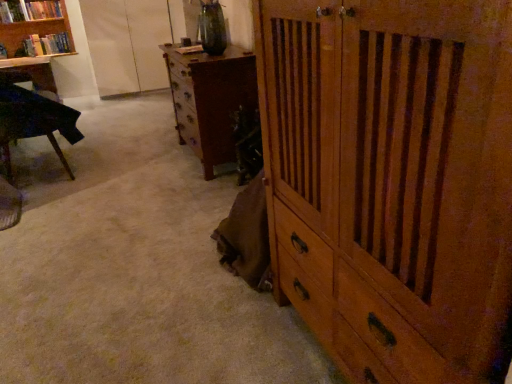
Image resolution: width=512 pixels, height=384 pixels. What do you see at coordinates (31, 74) in the screenshot?
I see `matte black desk at left` at bounding box center [31, 74].

Identify the location of white fabric screen door at upper left. [x=127, y=44].

Image resolution: width=512 pixels, height=384 pixels. I want to click on wooden bookshelf at upper left, so click(x=32, y=22).

What do you see at coordinates (47, 44) in the screenshot? The image size is (512, 384). I see `hardcover book at upper left, the 1th book when ordered from bottom to top` at bounding box center [47, 44].

Identify the location of matte black desk at left. (31, 74).

Is hardcover book at upper left, the 1th book when ordered from bottom to top, positioned beyond the bounds of wooden bookshelf at upper left?

No, most part of hardcover book at upper left, the 1th book when ordered from bottom to top, lies within wooden bookshelf at upper left.

From the wooden bookshelf at upper left, count 2nd book to the right and point to it. Please provide its 2D coordinates.

[(47, 44)]

Can you tell me how much hardcover book at upper left, the 1th book when ordered from bottom to top, and wooden bookshelf at upper left differ in facing direction?

0.00258 degrees separate the facing orientations of hardcover book at upper left, the 1th book when ordered from bottom to top, and wooden bookshelf at upper left.

Can you confirm if hardcover book at upper left, the 1th book when ordered from bottom to top, is positioned to the left of wooden bookshelf at upper left?

In fact, hardcover book at upper left, the 1th book when ordered from bottom to top, is to the right of wooden bookshelf at upper left.

Looking at their sizes, would you say black glossy table at left is wider or thinner than hardcover book at upper left, which is the second book from top to bottom?

Clearly, black glossy table at left has more width compared to hardcover book at upper left, which is the second book from top to bottom.

Is point (0, 104) behind point (42, 47)?

No, it is in front of (42, 47).

I want to click on chair on the right side of hardcover book at upper left, which is the second book from top to bottom, so click(x=38, y=118).

Is point (6, 19) closer to viewer compared to point (223, 66)?

No, it is not.

From the picture: In terms of width, does hardcover book at upper left, arranged as the second book when ordered from the bottom, look wider or thinner when compared to brown wooden chest of drawers at center, placed as the 1th chest of drawers when sorted from back to front?

Considering their sizes, hardcover book at upper left, arranged as the second book when ordered from the bottom, looks slimmer than brown wooden chest of drawers at center, placed as the 1th chest of drawers when sorted from back to front.

In the scene shown: Is hardcover book at upper left, arranged as the second book when ordered from the bottom, not within brown wooden chest of drawers at center, placed as the 2th chest of drawers when sorted from right to left?

That's correct, hardcover book at upper left, arranged as the second book when ordered from the bottom, is outside of brown wooden chest of drawers at center, placed as the 2th chest of drawers when sorted from right to left.

Does hardcover book at upper left, arranged as the second book when ordered from the bottom, turn towards brown wooden chest of drawers at center, placed as the 2th chest of drawers when sorted from right to left?

No, hardcover book at upper left, arranged as the second book when ordered from the bottom, does not turn towards brown wooden chest of drawers at center, placed as the 2th chest of drawers when sorted from right to left.

Consider the image. Between wooden bookshelf at upper left and white fabric screen door at upper left, which one has smaller width?

With smaller width is wooden bookshelf at upper left.

Does wooden bookshelf at upper left touch white fabric screen door at upper left?

No.

The image size is (512, 384). What are the coordinates of `bookcase above the white fabric screen door at upper left (from the image's perspective)` in the screenshot? It's located at (32, 22).

Is white fabric screen door at upper left at the right side of hardcover book at upper left, which is the 1th book in top-to-bottom order?

Yes.

Could you tell me if white fabric screen door at upper left is turned towards hardcover book at upper left, arranged as the second book when ordered from the bottom?

No, white fabric screen door at upper left is not oriented towards hardcover book at upper left, arranged as the second book when ordered from the bottom.

From the picture: From a real-world perspective, is white fabric screen door at upper left below hardcover book at upper left, which is the 1th book in top-to-bottom order?

Indeed, from a real-world perspective, white fabric screen door at upper left is positioned beneath hardcover book at upper left, which is the 1th book in top-to-bottom order.

Between white fabric screen door at upper left and hardcover book at upper left, which is the 1th book in top-to-bottom order, which one has smaller size?

With smaller size is hardcover book at upper left, which is the 1th book in top-to-bottom order.

Is wooden bookshelf at upper left further to camera compared to matte black desk at left?

Yes.

Are wooden bookshelf at upper left and matte black desk at left located far from each other?

wooden bookshelf at upper left is actually quite close to matte black desk at left.

Is wooden bookshelf at upper left situated inside matte black desk at left or outside?

wooden bookshelf at upper left is not enclosed by matte black desk at left.

Where is `bookcase on the left of matte black desk at left`? bookcase on the left of matte black desk at left is located at coordinates (32, 22).

Can you confirm if wooden cabinet at center, positioned as the first chest of drawers in right-to-left order, is positioned to the right of hardcover book at upper left, which is the second book from top to bottom?

Indeed, wooden cabinet at center, positioned as the first chest of drawers in right-to-left order, is positioned on the right side of hardcover book at upper left, which is the second book from top to bottom.

Considering the sizes of objects wooden cabinet at center, which is the first chest of drawers in front-to-back order, and hardcover book at upper left, which is the second book from top to bottom, in the image provided, who is taller, wooden cabinet at center, which is the first chest of drawers in front-to-back order, or hardcover book at upper left, which is the second book from top to bottom,?

Standing taller between the two is wooden cabinet at center, which is the first chest of drawers in front-to-back order.

From a real-world perspective, is wooden cabinet at center, marked as the second chest of drawers in a left-to-right arrangement, over hardcover book at upper left, which is the second book from top to bottom?

Incorrect, from a real-world perspective, wooden cabinet at center, marked as the second chest of drawers in a left-to-right arrangement, is lower than hardcover book at upper left, which is the second book from top to bottom.

Which is correct: wooden cabinet at center, marked as the second chest of drawers in a left-to-right arrangement, is inside hardcover book at upper left, the 1th book when ordered from bottom to top, or outside of it?

wooden cabinet at center, marked as the second chest of drawers in a left-to-right arrangement, is not enclosed by hardcover book at upper left, the 1th book when ordered from bottom to top.

Identify the location of the 2nd book behind when counting from the wooden bookshelf at upper left. (47, 44).

Identify the location of book that is the 1st one when counting leftward from the black glossy table at left. The image size is (512, 384). (47, 44).

Estimate the real-world distances between objects in this image. Which object is further from brown wooden chest of drawers at center, placed as the 1th chest of drawers when sorted from back to front, hardcover book at upper left, which is the second book from top to bottom, or white fabric screen door at upper left?

Among the two, hardcover book at upper left, which is the second book from top to bottom, is located further to brown wooden chest of drawers at center, placed as the 1th chest of drawers when sorted from back to front.

Based on their spatial positions, is white fabric screen door at upper left or wooden bookshelf at upper left closer to hardcover book at upper left, which is the 1th book in top-to-bottom order?

wooden bookshelf at upper left is closer to hardcover book at upper left, which is the 1th book in top-to-bottom order.

Consider the image. Based on their spatial positions, is black glossy table at left or hardcover book at upper left, which is the second book from top to bottom, closer to matte black desk at left?

Among the two, hardcover book at upper left, which is the second book from top to bottom, is located nearer to matte black desk at left.

From the image, which object appears to be farther from brown wooden chest of drawers at center, which is counted as the second chest of drawers, starting from the front, black glossy table at left or hardcover book at upper left, the 1th book when ordered from bottom to top?

hardcover book at upper left, the 1th book when ordered from bottom to top, is further to brown wooden chest of drawers at center, which is counted as the second chest of drawers, starting from the front.

When comparing their distances from matte black desk at left, does wooden bookshelf at upper left or hardcover book at upper left, the 1th book when ordered from bottom to top, seem closer?

Among the two, hardcover book at upper left, the 1th book when ordered from bottom to top, is located nearer to matte black desk at left.

Estimate the real-world distances between objects in this image. Which object is closer to matte black desk at left, hardcover book at upper left, the 1th book when ordered from bottom to top, or brown wooden chest of drawers at center, arranged as the first chest of drawers when viewed from the left?

hardcover book at upper left, the 1th book when ordered from bottom to top, is closer to matte black desk at left.

Which object lies further to the anchor point brown wooden chest of drawers at center, placed as the 1th chest of drawers when sorted from back to front, white fabric screen door at upper left or wooden cabinet at center, marked as the second chest of drawers in a left-to-right arrangement?

Among the two, white fabric screen door at upper left is located further to brown wooden chest of drawers at center, placed as the 1th chest of drawers when sorted from back to front.

Based on their spatial positions, is wooden cabinet at center, which is the first chest of drawers in front-to-back order, or hardcover book at upper left, which is the second book from top to bottom, further from brown wooden chest of drawers at center, placed as the 1th chest of drawers when sorted from back to front?

hardcover book at upper left, which is the second book from top to bottom, is positioned further to the anchor brown wooden chest of drawers at center, placed as the 1th chest of drawers when sorted from back to front.

You are a GUI agent. You are given a task and a screenshot of the screen. Output one action in this format:
    pyautogui.click(x=<x>, y=<y>)
    Task: Click on the chair between wooden cabinet at center, which is the first chest of drawers in front-to-back order, and hardcover book at upper left, the 1th book when ordered from bottom to top, from front to back
    The image size is (512, 384).
    Given the screenshot: What is the action you would take?
    pyautogui.click(x=38, y=118)

Where is `bookcase between black glossy table at left and white fabric screen door at upper left in the front-back direction`? bookcase between black glossy table at left and white fabric screen door at upper left in the front-back direction is located at coordinates (32, 22).

What are the coordinates of `chair between matte black desk at left and brown wooden chest of drawers at center, placed as the 2th chest of drawers when sorted from right to left, from left to right` in the screenshot? It's located at (38, 118).

Locate an element on the screen. The width and height of the screenshot is (512, 384). desk located between black glossy table at left and hardcover book at upper left, which is the second book from top to bottom, in the depth direction is located at coordinates (31, 74).